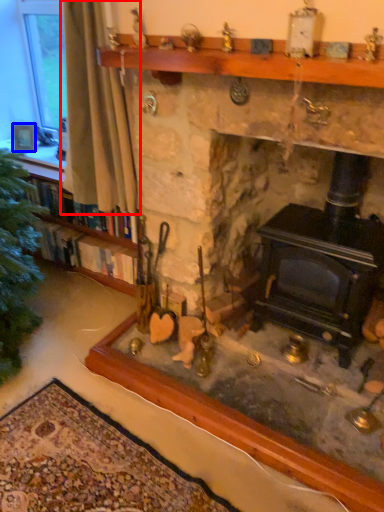
Question: Among these objects, which one is farthest to the camera, curtain (highlighted by a red box) or picture frame (highlighted by a blue box)?

Choices:
 (A) curtain
 (B) picture frame

Answer: (B)